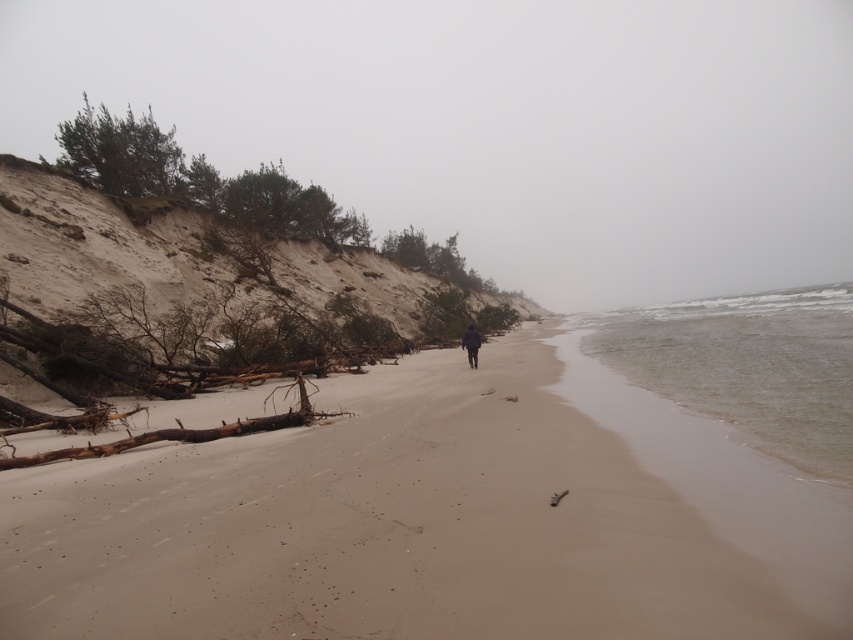
Who is positioned more to the right, sandy beach at center or clear water at lower right?

From the viewer's perspective, clear water at lower right appears more on the right side.

Can you confirm if sandy beach at center is positioned above clear water at lower right?

Incorrect, sandy beach at center is not positioned above clear water at lower right.

Between point (560, 620) and point (838, 292), which one is positioned behind?

Point (838, 292)

At what (x,y) coordinates should I click in order to perform the action: click on sandy beach at center. Please return your answer as a coordinate pair (x, y). The height and width of the screenshot is (640, 853). Looking at the image, I should click on (424, 524).

Between sandy beach at center and dark matte jacket at center, which one is positioned higher?

dark matte jacket at center is higher up.

Locate an element on the screen. The width and height of the screenshot is (853, 640). sandy beach at center is located at coordinates (424, 524).

The width and height of the screenshot is (853, 640). What are the coordinates of `sandy beach at center` in the screenshot? It's located at (424, 524).

Is clear water at lower right bigger than dark matte jacket at center?

Yes, clear water at lower right is bigger than dark matte jacket at center.

Does clear water at lower right have a smaller size compared to dark matte jacket at center?

Incorrect, clear water at lower right is not smaller in size than dark matte jacket at center.

Is point (814, 420) farther from viewer compared to point (468, 355)?

No, (814, 420) is closer to viewer.

In order to click on clear water at lower right in this screenshot , I will do `click(747, 365)`.